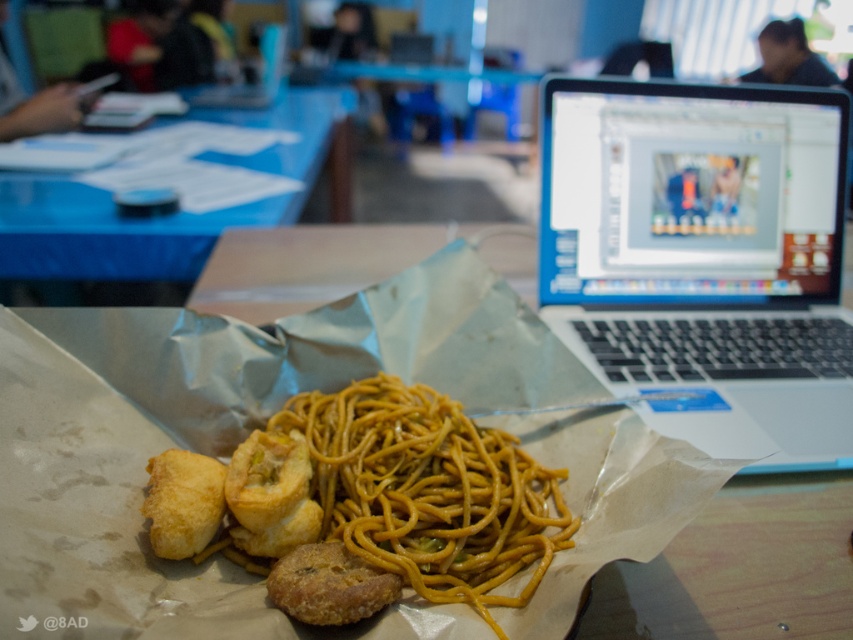
You are a food delivery person who needs to place a hot meal on a tray. The tray has a limited space. You see the yellow matte spaghetti at center and the golden fried chicken at lower left in the image. Which object should you place closer to the edge of the tray to avoid them touching each other?

The golden fried chicken at lower left should be placed closer to the edge of the tray because the yellow matte spaghetti at center is to the right of it, so positioning the fried chicken towards the edge would prevent them from touching.

You are a food delivery person who needs to pack the brown paper bag at center and the golden crispy fried at center into a delivery box. The delivery box can only hold items that are smaller than 30 cm in any dimension. Can both items fit inside the box?

The brown paper bag at center is larger in size than golden crispy fried at center. However, without specific measurements, we cannot confirm if the larger item exceeds the 30 cm limit. Contact the customer for clarification.